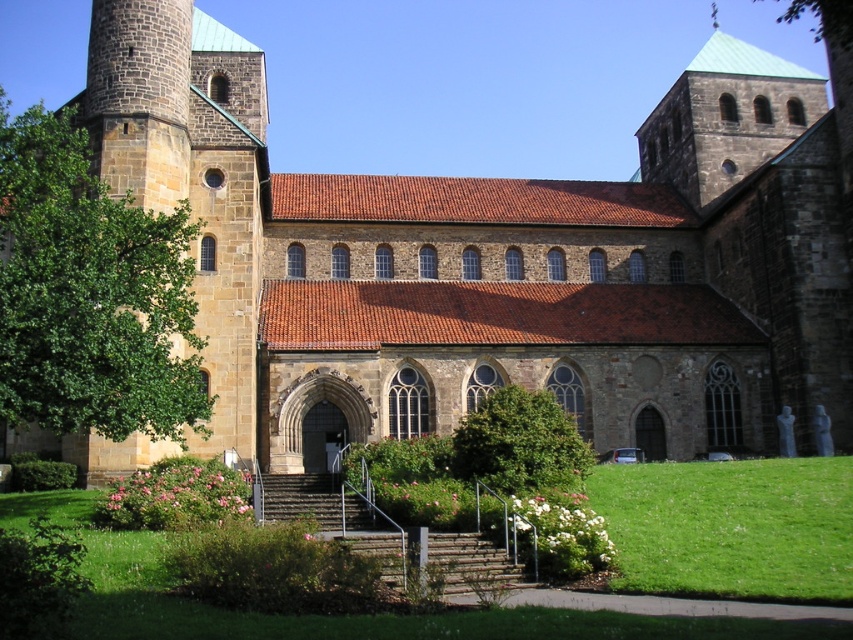
You are a landscape architect designing a walking path between the green leafy tree at left and the green leafy bush at center. What is the minimum length your path should be to ensure it reaches both points?

The green leafy tree at left and green leafy bush at center are 17.46 meters apart, so the minimum length of the path should be at least 17.46 meters to ensure it reaches both points.

You are standing in front of the historic stone church and notice a point marked at coordinates (520,444). Based on the scene description, what object is located at that point?

The point at coordinates (520,444) indicates a green leafy bush at center.